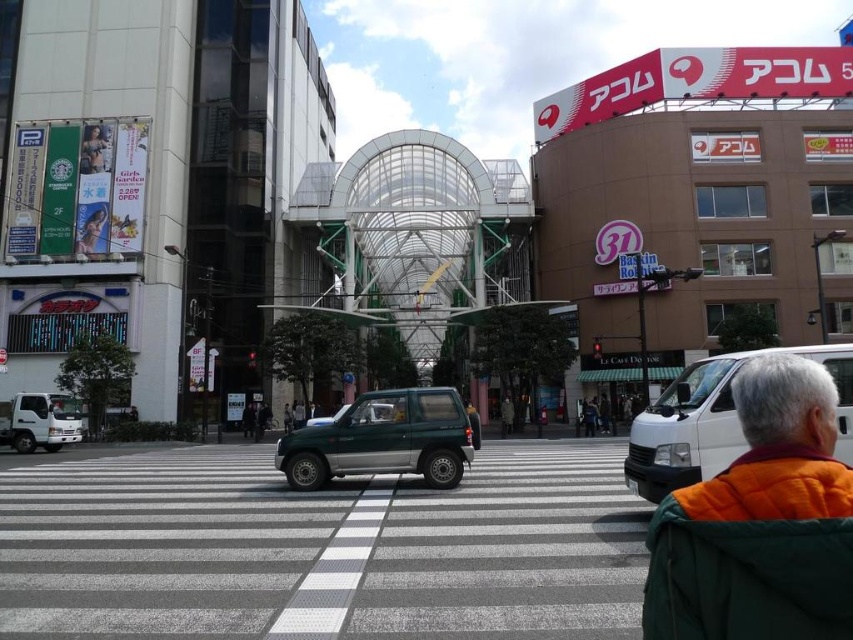
You are a delivery person standing at the crosswalk. You need to deliver a package to the person wearing the orange quilted jacket at lower right and the driver of the white matte van at center. Which recipient is shorter in height?

The orange quilted jacket at lower right has a lesser height compared to the white matte van at center, so the person wearing the orange quilted jacket at lower right is shorter.